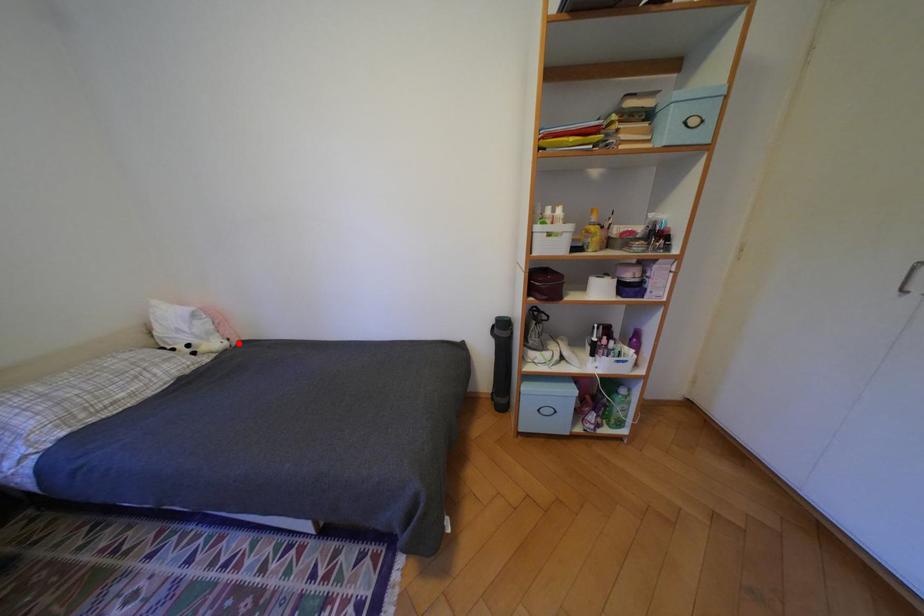
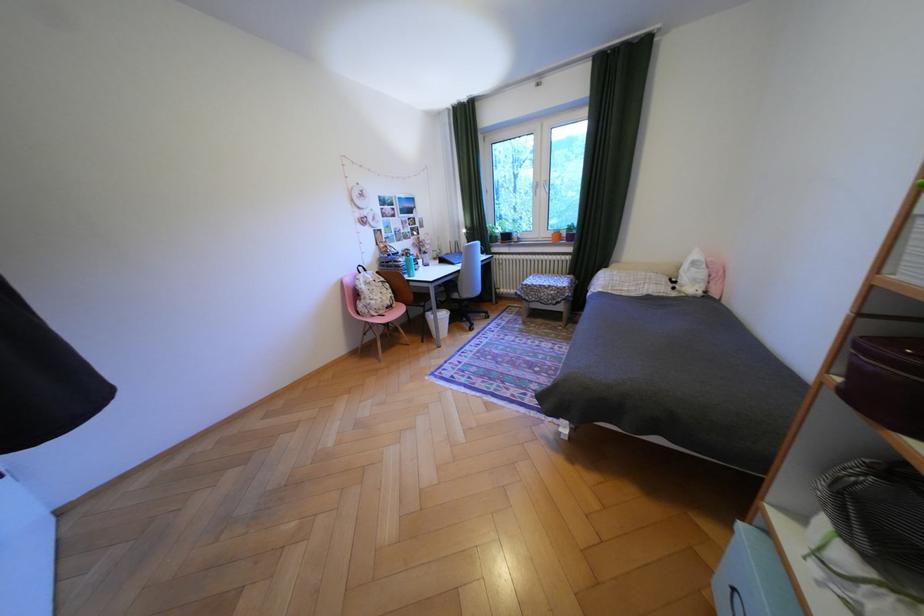
Find the pixel in the second image that matches the highlighted location in the first image.

(712, 293)